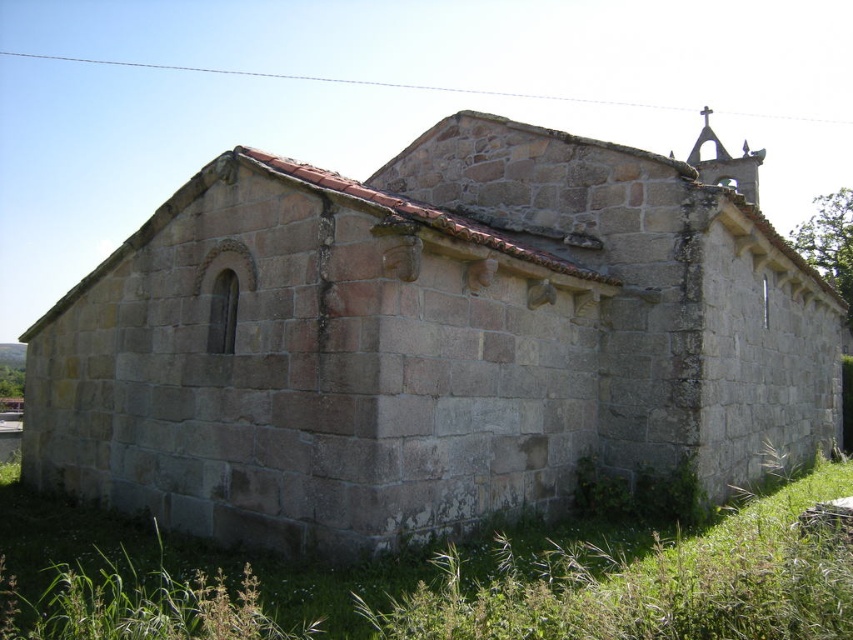
You are standing in a field and see the gray stone church at center and the green grass at lower right. Which object is located to the right of the other?

The gray stone church at center is positioned on the right side of green grass at lower right.

You are standing in front of the stone structure and want to know the distance to the point marked at coordinates point [436,284]. Can you estimate how far it is?

The point [436,284] is 9.11 meters away from the viewer.

You are standing at the coordinates 0.5, 0.5. Can you see the gray stone church at center from your current position?

Yes, since the gray stone church at center is located at point (431, 340), which is very close to your position at (426, 320), you can see it clearly.